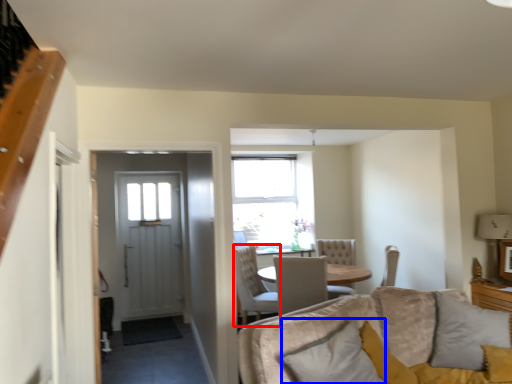
Question: Among these objects, which one is nearest to the camera, chair (highlighted by a red box) or pillow (highlighted by a blue box)?

Choices:
 (A) chair
 (B) pillow

Answer: (B)